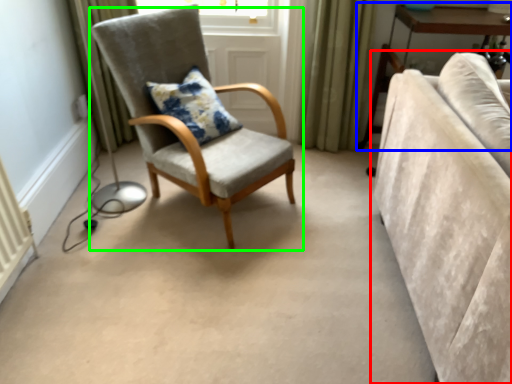
Question: Estimate the real-world distances between objects in this image. Which object is farther from studio couch (highlighted by a red box), table (highlighted by a blue box) or chair (highlighted by a green box)?

Choices:
 (A) table
 (B) chair

Answer: (A)